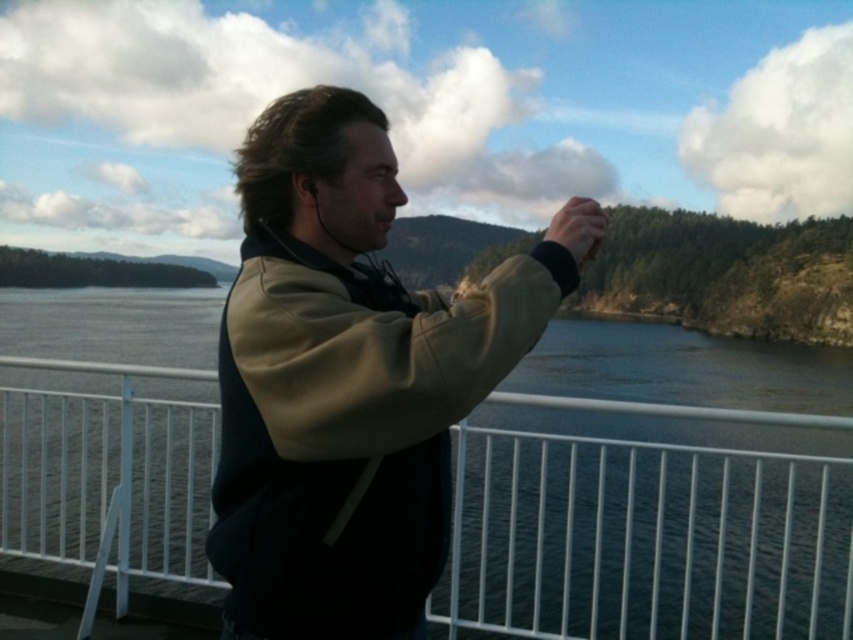
Question: Which object is farther from the camera taking this photo?

Choices:
 (A) white metal rail at center
 (B) khaki fleece jacket at center

Answer: (A)

Question: Is white metal rail at center below khaki fleece jacket at center?

Choices:
 (A) yes
 (B) no

Answer: (A)

Question: Which point is farther from the camera taking this photo?

Choices:
 (A) (776, 584)
 (B) (572, 227)

Answer: (A)

Question: Observing the image, what is the correct spatial positioning of white metal rail at center in reference to khaki fleece jacket at center?

Choices:
 (A) above
 (B) below

Answer: (B)

Question: Can you confirm if white metal rail at center is smaller than khaki fleece jacket at center?

Choices:
 (A) no
 (B) yes

Answer: (A)